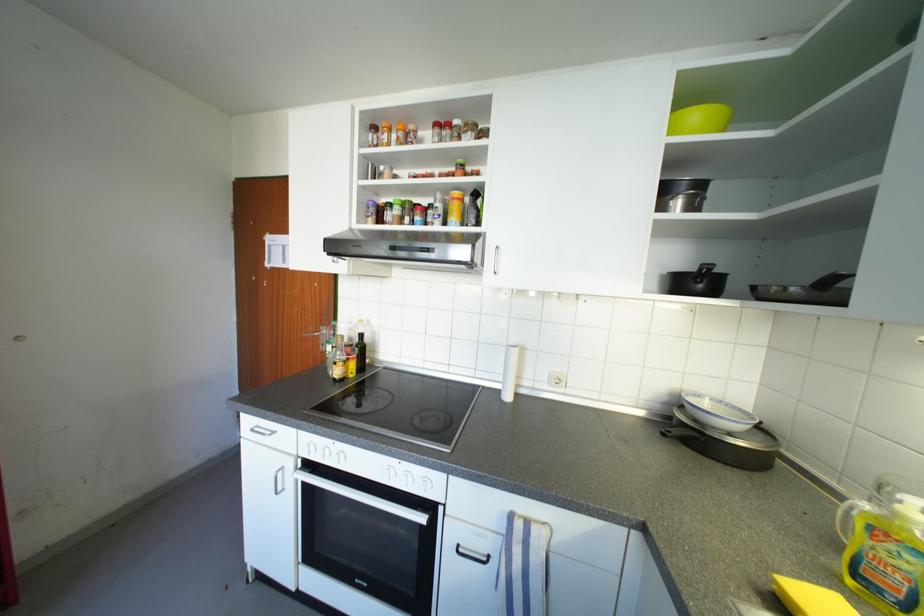
The height and width of the screenshot is (616, 924). Find the location of `yellow bottle handle`. yellow bottle handle is located at coordinates (809, 598).